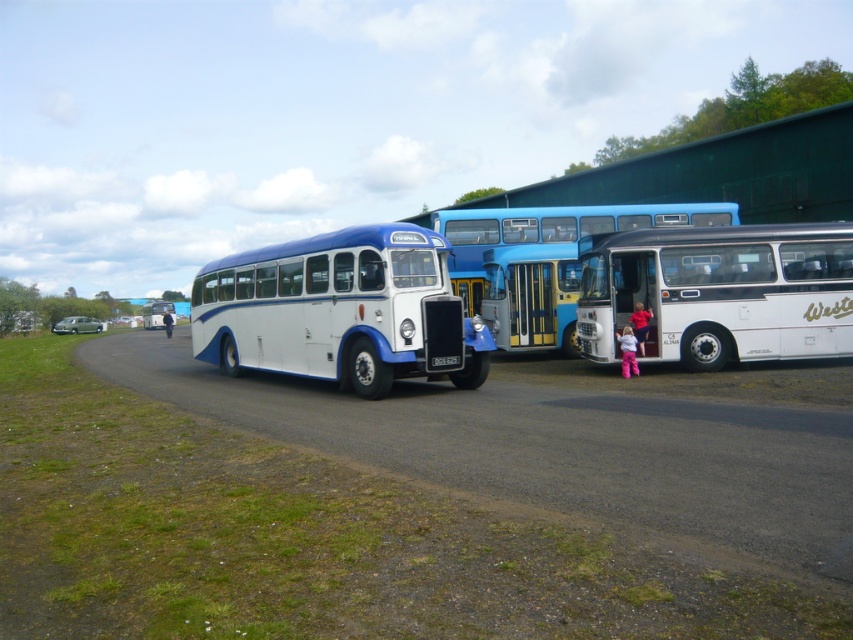
You are a GUI agent. You are given a task and a screenshot of the screen. Output one action in this format:
    pyautogui.click(x=<x>, y=<y>)
    Task: Click on the dirt track at lower left
    
    Given the screenshot: What is the action you would take?
    pyautogui.click(x=550, y=448)

Describe the element at coordinates (550, 448) in the screenshot. Image resolution: width=853 pixels, height=640 pixels. I see `dirt track at lower left` at that location.

Find the location of a particular element. This screenshot has height=640, width=853. dirt track at lower left is located at coordinates (550, 448).

Where is `dirt track at lower left`? The height and width of the screenshot is (640, 853). dirt track at lower left is located at coordinates (550, 448).

Is matte white tour bus at center shorter than white matte bus at center?

In fact, matte white tour bus at center may be taller than white matte bus at center.

Does matte white tour bus at center have a smaller size compared to white matte bus at center?

No, matte white tour bus at center is not smaller than white matte bus at center.

Is point (352, 348) less distant than point (579, 337)?

Yes, point (352, 348) is in front of point (579, 337).

Where is `matte white tour bus at center`? matte white tour bus at center is located at coordinates (340, 310).

Who is taller, dirt track at lower left or white matte bus at center?

With more height is white matte bus at center.

Describe the element at coordinates (550, 448) in the screenshot. I see `dirt track at lower left` at that location.

You are a GUI agent. You are given a task and a screenshot of the screen. Output one action in this format:
    pyautogui.click(x=<x>, y=<y>)
    Task: Click on the dirt track at lower left
    Image resolution: width=853 pixels, height=640 pixels.
    Given the screenshot: What is the action you would take?
    pyautogui.click(x=550, y=448)